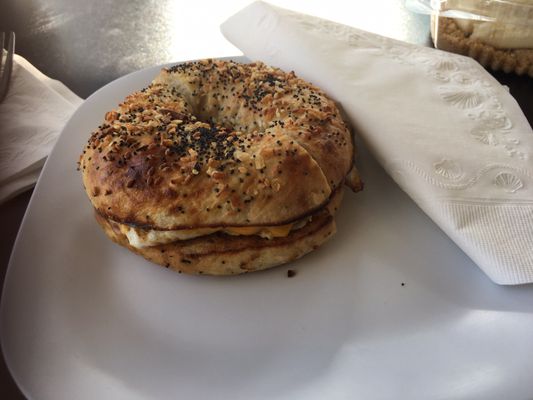
This screenshot has width=533, height=400. I want to click on napkin, so click(x=466, y=170), click(x=34, y=124), click(x=66, y=94).